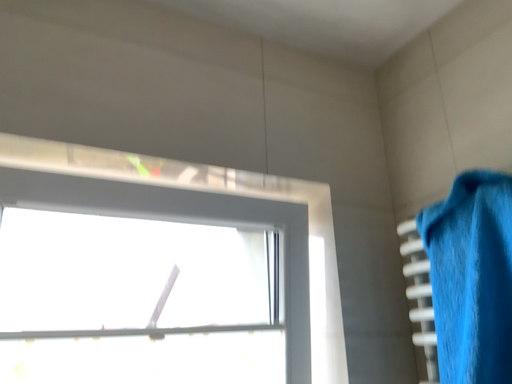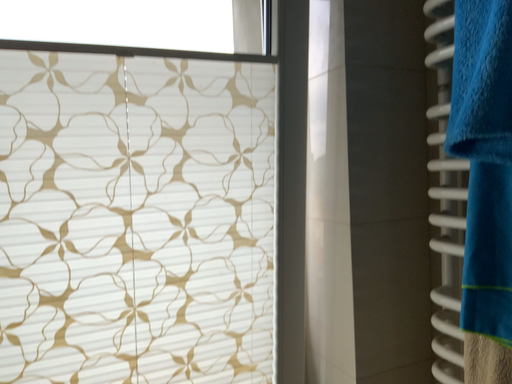
Question: Which way did the camera rotate in the video?

Choices:
 (A) rotated downward
 (B) rotated upward

Answer: (A)